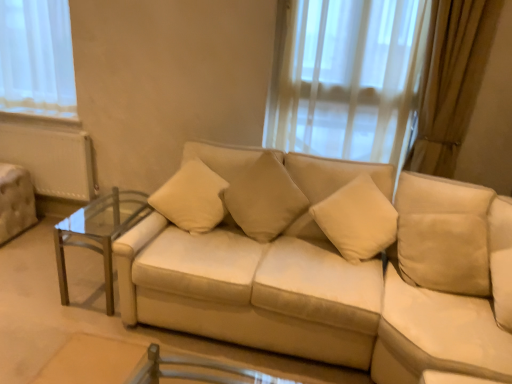
Measure the distance between beige fabric pillow at center, the 1th pillow from the left, and camera.

beige fabric pillow at center, the 1th pillow from the left, is 7.64 feet from camera.

Where is `clear glass table at left`? The image size is (512, 384). clear glass table at left is located at coordinates (99, 233).

From a real-world perspective, is clear glass table at left below beige fabric pillow at center, the 1th pillow from the left?

Correct, in the physical world, clear glass table at left is lower than beige fabric pillow at center, the 1th pillow from the left.

Which is behind, point (99, 234) or point (218, 220)?

Point (99, 234)

What's the angular difference between clear glass table at left and beige fabric pillow at center, the 2th pillow in the right-to-left sequence,'s facing directions?

19.9 degrees separate the facing orientations of clear glass table at left and beige fabric pillow at center, the 2th pillow in the right-to-left sequence.

From a real-world perspective, which is physically below, beige fabric pillow at center, placed as the 1th pillow when sorted from right to left, or clear glass table at left?

clear glass table at left.

Which is correct: beige fabric pillow at center, placed as the 1th pillow when sorted from right to left, is inside clear glass table at left, or outside of it?

beige fabric pillow at center, placed as the 1th pillow when sorted from right to left, is located beyond the bounds of clear glass table at left.

How distant is beige fabric pillow at center, placed as the 1th pillow when sorted from right to left, from clear glass table at left?

beige fabric pillow at center, placed as the 1th pillow when sorted from right to left, is 39.31 inches away from clear glass table at left.

There is a clear glass table at left. Identify the location of the 1st pillow above it (from the image's perspective). (264, 199).

From the image's perspective, is beige fabric pillow at center, the 2th pillow in the right-to-left sequence, over clear glass table at left?

Yes.

Considering the sizes of objects beige fabric pillow at center, the 2th pillow in the right-to-left sequence, and clear glass table at left in the image provided, who is wider, beige fabric pillow at center, the 2th pillow in the right-to-left sequence, or clear glass table at left?

clear glass table at left.

How far apart are beige fabric pillow at center, the 1th pillow from the left, and clear glass table at left?

beige fabric pillow at center, the 1th pillow from the left, and clear glass table at left are 24.48 inches apart from each other.

How different are the orientations of beige fabric pillow at center, the 2th pillow in the right-to-left sequence, and clear glass table at left in degrees?

The angular difference between beige fabric pillow at center, the 2th pillow in the right-to-left sequence, and clear glass table at left is 19.9 degrees.

What's the angular difference between beige fabric pillow at center, placed as the 1th pillow when sorted from right to left, and beige suede couch at center's facing directions?

beige fabric pillow at center, placed as the 1th pillow when sorted from right to left, and beige suede couch at center are facing 9.65 degrees away from each other.

Considering the sizes of objects beige fabric pillow at center, placed as the 1th pillow when sorted from right to left, and beige suede couch at center in the image provided, who is bigger, beige fabric pillow at center, placed as the 1th pillow when sorted from right to left, or beige suede couch at center?

With larger size is beige suede couch at center.

Is beige fabric pillow at center, placed as the 1th pillow when sorted from right to left, to the left or to the right of beige suede couch at center in the image?

In the image, beige fabric pillow at center, placed as the 1th pillow when sorted from right to left, appears on the left side of beige suede couch at center.

Locate an element on the screen. studio couch below the beige fabric pillow at center, placed as the 1th pillow when sorted from right to left (from the image's perspective) is located at coordinates (336, 269).

How many degrees apart are the facing directions of beige fabric pillow at center, the 1th pillow from the left, and beige suede couch at center?

There is a 20.3-degree angle between the facing directions of beige fabric pillow at center, the 1th pillow from the left, and beige suede couch at center.

Would you say beige fabric pillow at center, the 1th pillow from the left, is outside beige suede couch at center?

No, most part of beige fabric pillow at center, the 1th pillow from the left, lies within beige suede couch at center.

Does beige fabric pillow at center, the 2th pillow in the right-to-left sequence, have a lesser width compared to beige suede couch at center?

Yes.

Could you measure the distance between beige fabric pillow at center, the 1th pillow from the left, and beige suede couch at center?

beige fabric pillow at center, the 1th pillow from the left, and beige suede couch at center are 47.49 centimeters apart.

Can you tell me how much beige fabric pillow at center, placed as the 1th pillow when sorted from right to left, and beige suede swivel chair at right differ in facing direction?

They differ by 30.6 degrees in their facing directions.

Which is less distant, (249,188) or (458,332)?

Point (249,188) appears to be farther away from the viewer than point (458,332).

From a real-world perspective, is beige fabric pillow at center, marked as the 2th pillow in a left-to-right arrangement, located beneath beige suede swivel chair at right?

Actually, beige fabric pillow at center, marked as the 2th pillow in a left-to-right arrangement, is physically above beige suede swivel chair at right in the real world.

Can you confirm if beige fabric pillow at center, marked as the 2th pillow in a left-to-right arrangement, is wider than beige suede swivel chair at right?

In fact, beige fabric pillow at center, marked as the 2th pillow in a left-to-right arrangement, might be narrower than beige suede swivel chair at right.

Is beige suede couch at center facing away from clear glass table at left?

No, beige suede couch at center's orientation is not away from clear glass table at left.

Based on their sizes in the image, would you say beige suede couch at center is bigger or smaller than clear glass table at left?

beige suede couch at center is bigger than clear glass table at left.

In the image, there is a beige fabric pillow at center, the 2th pillow in the right-to-left sequence. Identify the location of table below it (from a real-world perspective). This screenshot has height=384, width=512. (99, 233).

Identify the location of table below the beige fabric pillow at center, marked as the 2th pillow in a left-to-right arrangement (from the image's perspective). (99, 233).

Considering their positions, is beige suede swivel chair at right positioned closer to beige fabric pillow at center, the 2th pillow in the right-to-left sequence, than clear glass table at left?

Among the two, clear glass table at left is located nearer to beige fabric pillow at center, the 2th pillow in the right-to-left sequence.

From the image, which object appears to be farther from clear glass table at left, beige suede swivel chair at right or beige suede couch at center?

beige suede swivel chair at right lies further to clear glass table at left than the other object.

Which object lies further to the anchor point beige fabric pillow at center, the 1th pillow from the left, beige suede couch at center or beige suede swivel chair at right?

The object further to beige fabric pillow at center, the 1th pillow from the left, is beige suede swivel chair at right.

Estimate the real-world distances between objects in this image. Which object is further from clear glass table at left, beige suede couch at center or beige fabric pillow at center, the 2th pillow in the right-to-left sequence?

The object further to clear glass table at left is beige suede couch at center.

Which object lies nearer to the anchor point beige suede couch at center, beige suede swivel chair at right or beige fabric pillow at center, the 2th pillow in the right-to-left sequence?

Based on the image, beige suede swivel chair at right appears to be nearer to beige suede couch at center.

Which object lies nearer to the anchor point beige suede couch at center, beige fabric pillow at center, marked as the 2th pillow in a left-to-right arrangement, or beige fabric pillow at center, the 2th pillow in the right-to-left sequence?

The object closer to beige suede couch at center is beige fabric pillow at center, marked as the 2th pillow in a left-to-right arrangement.

Looking at the image, which one is located further to beige fabric pillow at center, the 2th pillow in the right-to-left sequence, beige suede couch at center or beige fabric pillow at center, marked as the 2th pillow in a left-to-right arrangement?

beige suede couch at center is positioned further to the anchor beige fabric pillow at center, the 2th pillow in the right-to-left sequence.

Based on their spatial positions, is clear glass table at left or beige fabric pillow at center, placed as the 1th pillow when sorted from right to left, closer to beige suede swivel chair at right?

Among the two, beige fabric pillow at center, placed as the 1th pillow when sorted from right to left, is located nearer to beige suede swivel chair at right.

Where is `studio couch located between beige fabric pillow at center, marked as the 2th pillow in a left-to-right arrangement, and beige suede swivel chair at right in the left-right direction`? studio couch located between beige fabric pillow at center, marked as the 2th pillow in a left-to-right arrangement, and beige suede swivel chair at right in the left-right direction is located at coordinates (336, 269).

Find the location of a particular element. studio couch between clear glass table at left and beige suede swivel chair at right is located at coordinates (336, 269).

Find the location of a particular element. pillow located between beige suede couch at center and beige fabric pillow at center, the 1th pillow from the left, in the depth direction is located at coordinates (264, 199).

The height and width of the screenshot is (384, 512). I want to click on pillow between clear glass table at left and beige fabric pillow at center, marked as the 2th pillow in a left-to-right arrangement, from left to right, so click(192, 198).